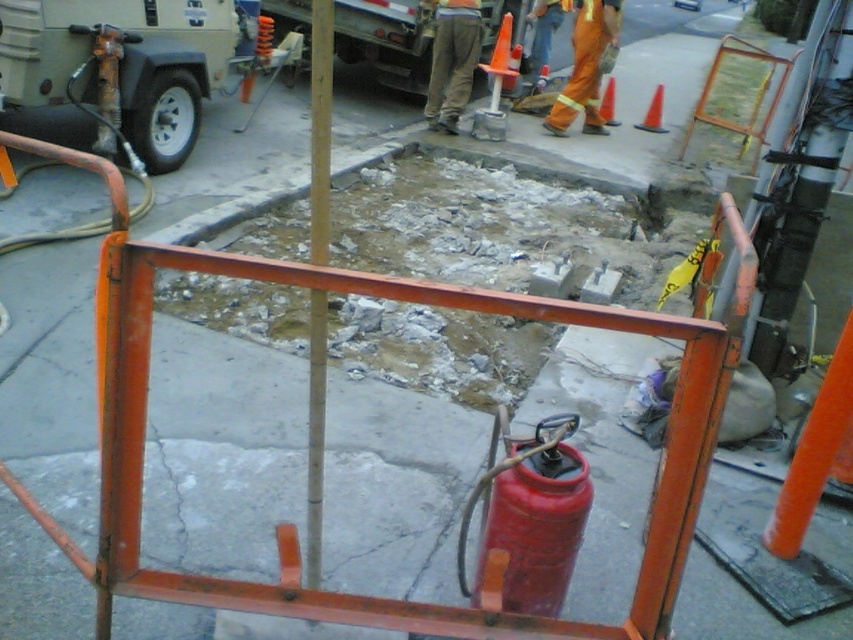
You are a drone operator tasked with capturing aerial footage of the construction site. You need to ensure that both points, point (572,112) and point (604,108), are visible in your shot. Given their positions, which point will appear larger in your camera frame?

Point (572,112) will appear larger in the camera frame because it is closer to the camera than point (604,108).

You are a delivery driver who needs to navigate through the construction site. There is an orange plastic traffic cone at upper right. Can you determine its exact position on the site using coordinates?

The orange plastic traffic cone at upper right is located at point (653, 113).